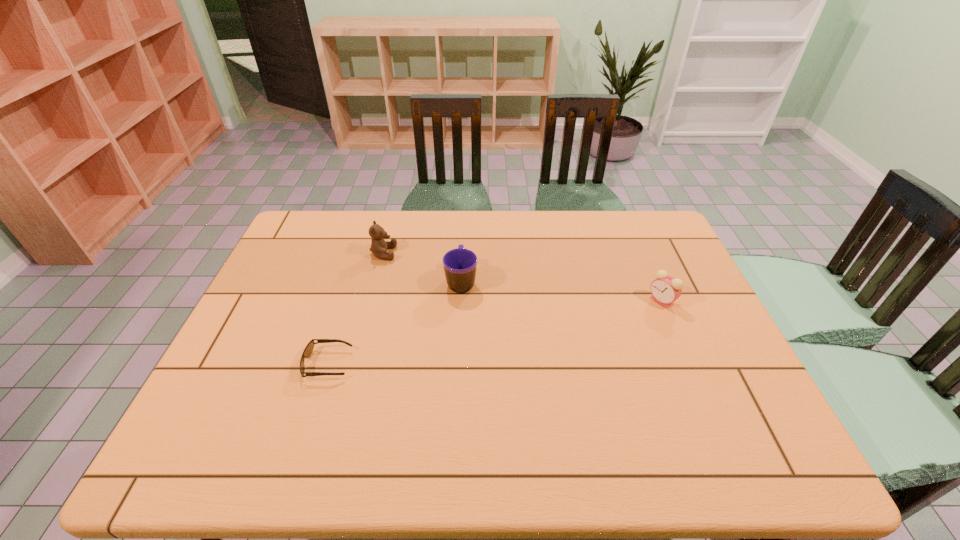
At what (x,y) coordinates should I click in order to perform the action: click on vacant space located 0.360m on the face of the alarm clock. Please return your answer as a coordinate pair (x, y). Looking at the image, I should click on (524, 301).

Identify the location of vacant point located on the face of the alarm clock. (524, 301).

Image resolution: width=960 pixels, height=540 pixels. In order to click on free region located 0.210m on the front-facing side of the sunglasses in this screenshot , I will do `click(434, 364)`.

Locate an element on the screen. This screenshot has height=540, width=960. object situated at the far edge is located at coordinates (379, 246).

Locate an element on the screen. The width and height of the screenshot is (960, 540). object that is at the right edge is located at coordinates (665, 289).

Find the location of a particular element. blank area at the far edge is located at coordinates (537, 243).

Find the location of `vacant space at the left edge of the desktop`. vacant space at the left edge of the desktop is located at coordinates (243, 415).

I want to click on free space at the right edge of the desktop, so click(685, 376).

Find the location of a particular element. The image size is (960, 540). vacant region at the far right corner of the desktop is located at coordinates (636, 237).

Where is `free space between the sunglasses and the teddy bear`? free space between the sunglasses and the teddy bear is located at coordinates (356, 308).